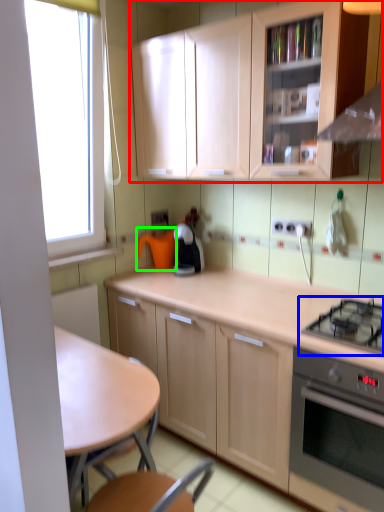
Question: Which is farther away from cabinetry (highlighted by a red box)? gas stove (highlighted by a blue box) or appliance (highlighted by a green box)?

Choices:
 (A) gas stove
 (B) appliance

Answer: (A)